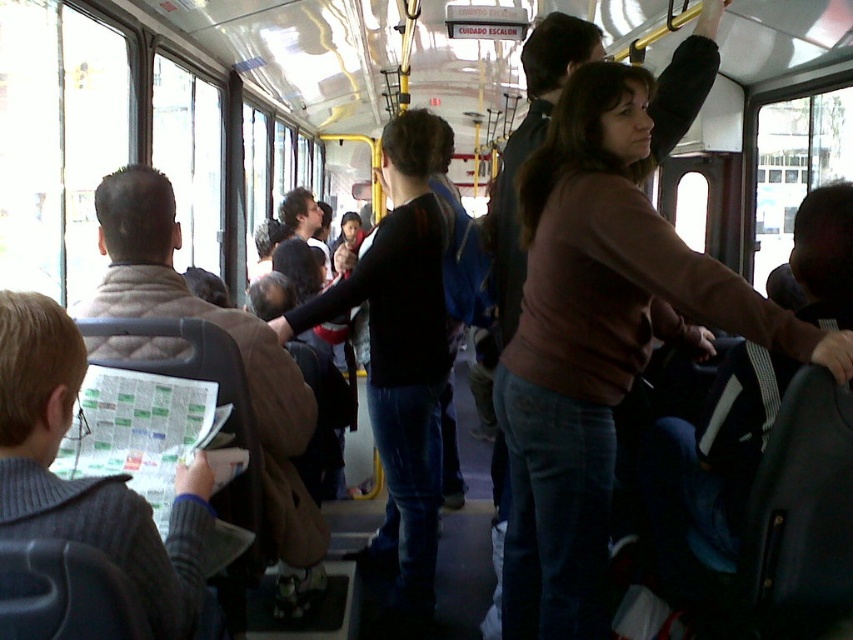
Does brown matte sweater at upper center have a greater height compared to gray knitted sweater at left?

Correct, brown matte sweater at upper center is much taller as gray knitted sweater at left.

Between brown matte sweater at upper center and gray knitted sweater at left, which one is positioned lower?

Positioned lower is gray knitted sweater at left.

At what (x,y) coordinates should I click in order to perform the action: click on brown matte sweater at upper center. Please return your answer as a coordinate pair (x, y). The width and height of the screenshot is (853, 640). Looking at the image, I should click on (606, 323).

Who is more distant from viewer, [399,445] or [27,481]?

Positioned behind is point [399,445].

Does dark blue jeans at center appear on the left side of gray knitted sweater at left?

In fact, dark blue jeans at center is to the right of gray knitted sweater at left.

Which is in front, point (389, 224) or point (183, 618)?

Point (183, 618) is in front.

Where is `dark blue jeans at center`? The height and width of the screenshot is (640, 853). dark blue jeans at center is located at coordinates (399, 355).

What do you see at coordinates (606, 323) in the screenshot?
I see `brown matte sweater at upper center` at bounding box center [606, 323].

Is brown matte sweater at upper center positioned behind dark blue jeans at center?

No.

Describe the element at coordinates (606, 323) in the screenshot. I see `brown matte sweater at upper center` at that location.

Where is `brown matte sweater at upper center`? This screenshot has width=853, height=640. brown matte sweater at upper center is located at coordinates (606, 323).